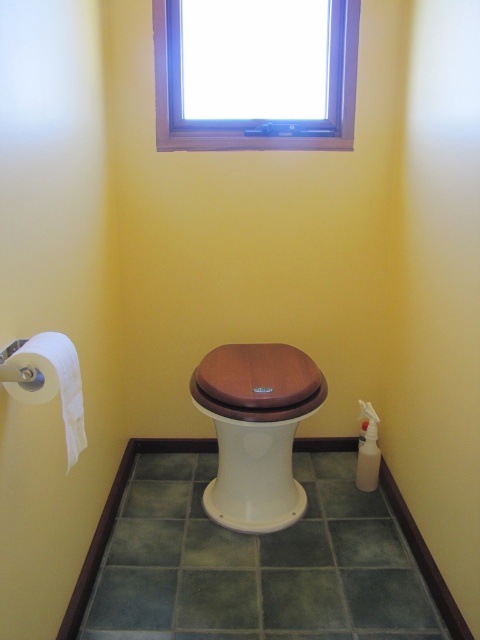
Question: Considering the relative positions of brown matte toilet at center and wooden toilet lid at center in the image provided, where is brown matte toilet at center located with respect to wooden toilet lid at center?

Choices:
 (A) below
 (B) above

Answer: (A)

Question: Which object is closer to the camera taking this photo?

Choices:
 (A) white paper at left
 (B) brown matte toilet at center

Answer: (A)

Question: Can you confirm if wooden frame at upper center is positioned to the right of wooden toilet lid at center?

Choices:
 (A) no
 (B) yes

Answer: (A)

Question: Among these objects, which one is nearest to the camera?

Choices:
 (A) wooden frame at upper center
 (B) brown matte toilet at center

Answer: (B)

Question: Is wooden frame at upper center wider than wooden toilet lid at center?

Choices:
 (A) yes
 (B) no

Answer: (A)

Question: Among these points, which one is farthest from the camera?

Choices:
 (A) (242, 483)
 (B) (357, 3)
 (C) (291, 400)
 (D) (78, 413)

Answer: (A)